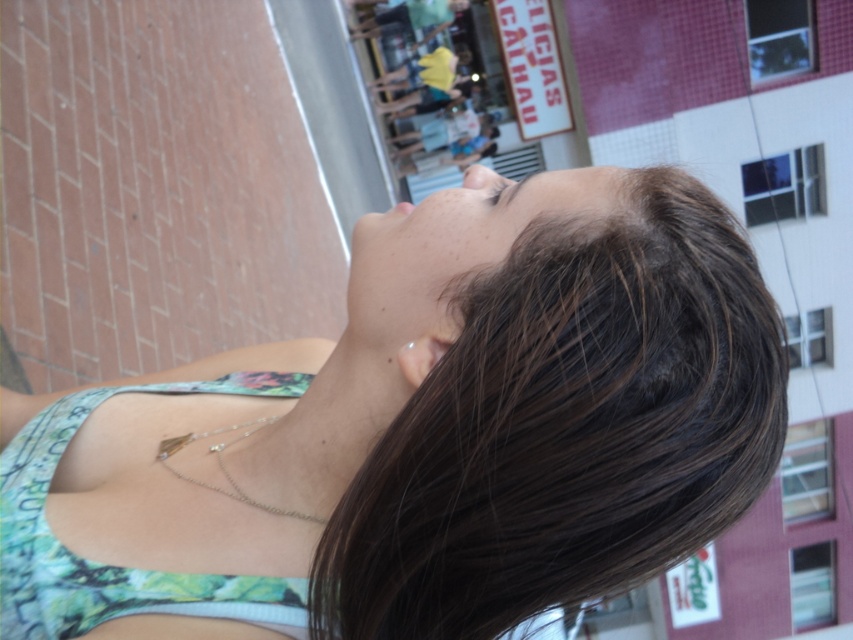
Is point (151, 412) in front of point (396, 316)?

No.

Which is in front, point (273, 392) or point (415, 330)?

Point (415, 330)

Does point (440, 243) come closer to viewer compared to point (520, 198)?

Yes, point (440, 243) is in front of point (520, 198).

This screenshot has height=640, width=853. Identify the location of green floral tank top at center. (419, 433).

Can you confirm if green floral tank top at center is thinner than brown matte eye at upper center?

No.

Can you confirm if green floral tank top at center is positioned to the right of brown matte eye at upper center?

In fact, green floral tank top at center is to the left of brown matte eye at upper center.

Between point (570, 300) and point (486, 198), which one is positioned behind?

Point (486, 198)

At what (x,y) coordinates should I click in order to perform the action: click on green floral tank top at center. Please return your answer as a coordinate pair (x, y). This screenshot has height=640, width=853. Looking at the image, I should click on (419, 433).

Does green floral tank top at center appear on the left side of matte skin nose at center?

Indeed, green floral tank top at center is positioned on the left side of matte skin nose at center.

Does green floral tank top at center appear over matte skin nose at center?

No.

Which is behind, point (601, 493) or point (479, 182)?

The point (479, 182) is more distant.

Locate an element on the screen. Image resolution: width=853 pixels, height=640 pixels. green floral tank top at center is located at coordinates click(x=419, y=433).